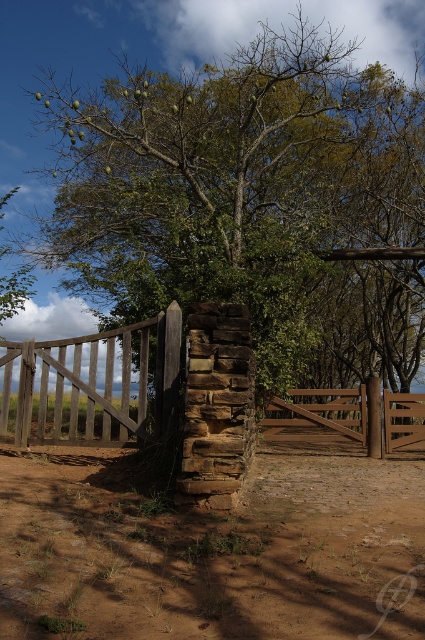
You are standing at the entrance of the rustic outdoor scene and want to walk through the brown wooden gate at center. However, there is a green leafy tree at center blocking your path. Can you pass through the gate without touching the tree?

The green leafy tree at center is positioned over the brown wooden gate at center, so you can pass through the gate without touching the tree since the tree is above it and not directly in front of the gate.

You are standing at the entrance of the wooden gate and want to walk directly towards the green leafy tree at center. Based on the coordinates provided, in which direction should you head relative to the gate?

The green leafy tree at center is located at coordinates point (252, 202), so you should head towards the center of the scene to reach it.

You are standing in front of the rustic outdoor scene and want to walk through the open wooden gate. Which object, the brown dirt field at center or the brown wooden gate at center, is lower in height and thus easier to step over if needed?

The brown dirt field at center is shorter than the brown wooden gate at center, so it is lower in height and easier to step over.